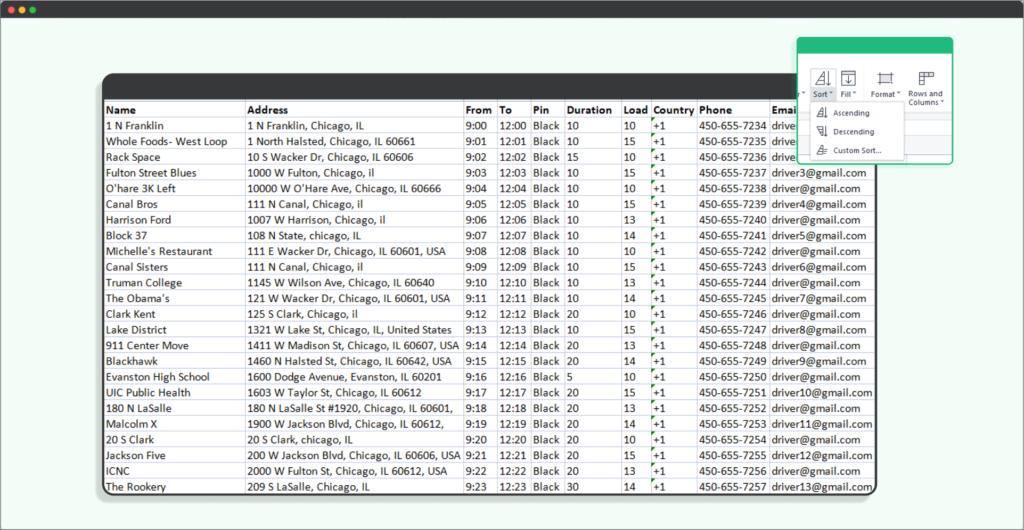
Where is `columns`? The height and width of the screenshot is (530, 1024). columns is located at coordinates (160, 106), (291, 109), (477, 109), (509, 110), (545, 109), (578, 107), (633, 107), (671, 106), (714, 106), (777, 110).